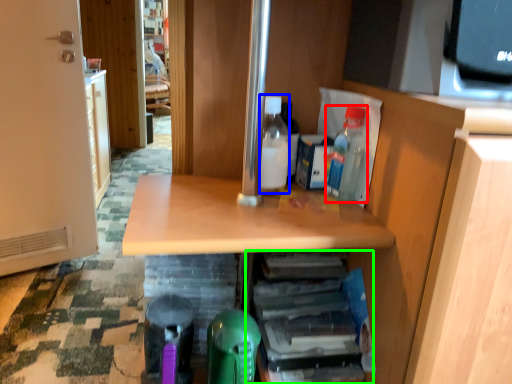
Question: Considering the real-world distances, which object is farthest from bottle (highlighted by a red box)? bottle (highlighted by a blue box) or shelf (highlighted by a green box)?

Choices:
 (A) bottle
 (B) shelf

Answer: (B)